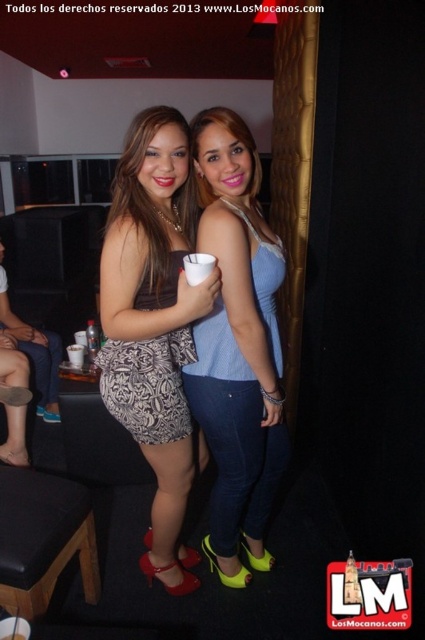
Question: Among these points, which one is farthest from the camera?

Choices:
 (A) (31, 564)
 (B) (116, 340)

Answer: (B)

Question: Which point is closer to the camera taking this photo?

Choices:
 (A) (56, 496)
 (B) (275, 484)

Answer: (A)

Question: In this image, where is patterned fabric skirt at center located relative to blue denim jeans at center?

Choices:
 (A) right
 (B) left

Answer: (B)

Question: Does blue denim jeans at center have a larger size compared to black leather stool at lower left?

Choices:
 (A) no
 (B) yes

Answer: (B)

Question: Among these points, which one is nearest to the camera?

Choices:
 (A) (73, 524)
 (B) (178, 326)
 (C) (232, 536)

Answer: (B)

Question: Can you confirm if patterned fabric skirt at center is smaller than blue denim jeans at center?

Choices:
 (A) no
 (B) yes

Answer: (A)